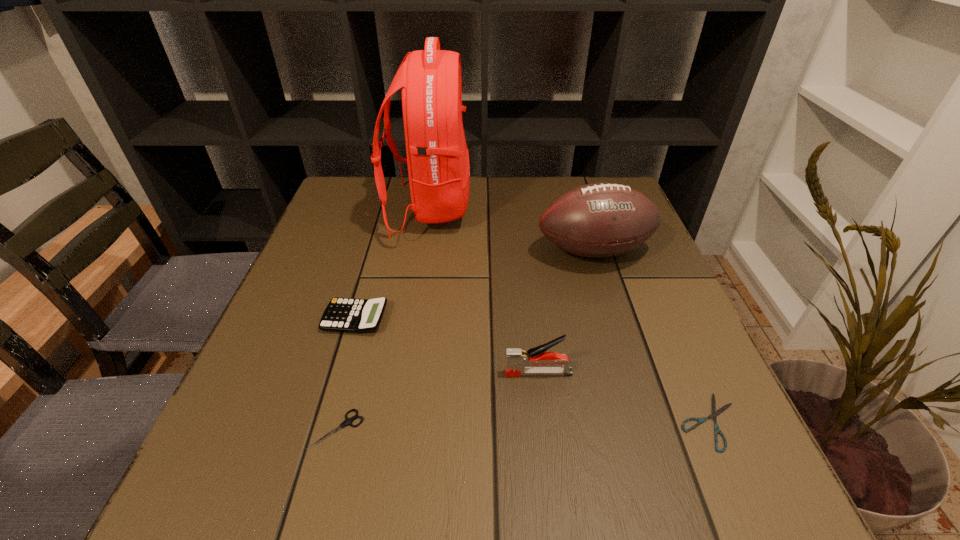
At what (x,y) coordinates should I click in order to perform the action: click on vacant area situated on the main compartment of the backpack. Please return your answer as a coordinate pair (x, y). Looking at the image, I should click on (541, 209).

Find the location of a particular element. vacant area situated on the left of the second tallest object is located at coordinates (442, 252).

This screenshot has width=960, height=540. I want to click on free space located on the handle side of the stapler, so click(x=471, y=373).

Identify the location of free region located 0.200m on the handle side of the stapler. The width and height of the screenshot is (960, 540). (392, 373).

At what (x,y) coordinates should I click in order to perform the action: click on vacant space positioned 0.050m on the handle side of the stapler. Please return your answer as a coordinate pair (x, y). This screenshot has height=540, width=960. Looking at the image, I should click on (477, 373).

Locate an element on the screen. free location located on the right of the third farthest object is located at coordinates (588, 319).

Locate an element on the screen. The width and height of the screenshot is (960, 540). free space located on the back of the taller shears is located at coordinates (381, 263).

What are the coordinates of `vacant point located 0.390m on the left of the right shears` in the screenshot? It's located at (435, 421).

The height and width of the screenshot is (540, 960). Identify the location of object at the far edge. (438, 163).

I want to click on calculator located in the left edge section of the desktop, so click(x=341, y=314).